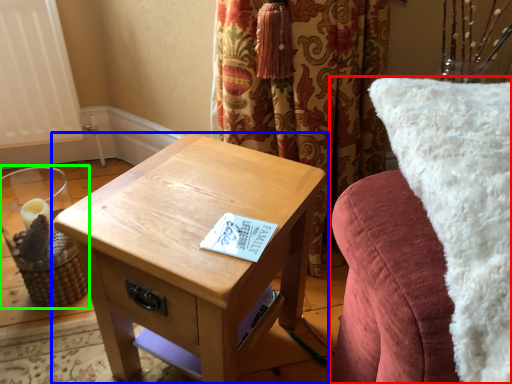
Question: Based on their relative distances, which object is farther from furniture (highlighted by a red box)? Choose from table (highlighted by a blue box) and candle holder (highlighted by a green box).

Choices:
 (A) table
 (B) candle holder

Answer: (B)